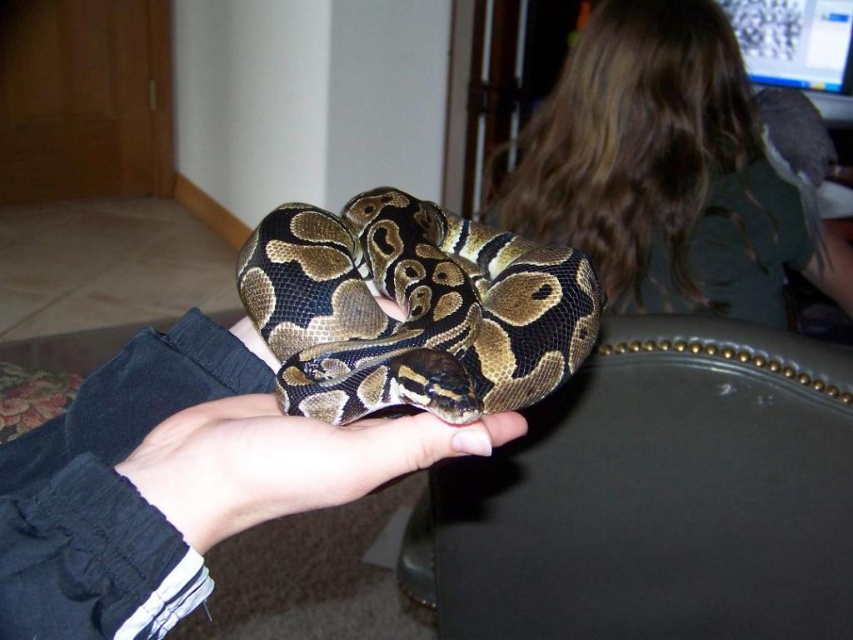
You are a photographer trying to capture the person holding the snake. You want to ensure the dark brown hair at upper right is visible in the photo. Where should you position your camera relative to the current viewpoint?

The dark brown hair at upper right is located at point (x=665, y=172), so you should position your camera slightly to the upper right of the current viewpoint to ensure it is visible.

You are a photographer taking a close up photo of a person holding a snake. You notice a point marked at coordinates [665,172] in the scene. What object is located at that point?

The point at coordinates [665,172] marks dark brown hair at upper right.